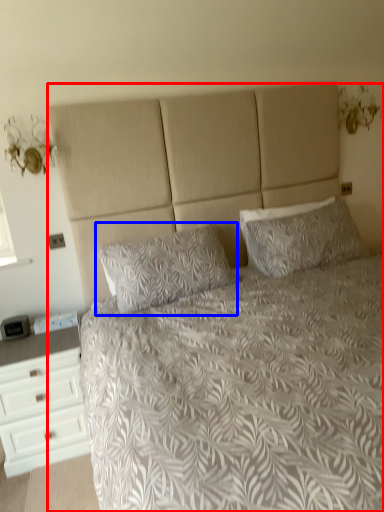
Question: Which object is further to the camera taking this photo, bed (highlighted by a red box) or pillow (highlighted by a blue box)?

Choices:
 (A) bed
 (B) pillow

Answer: (B)